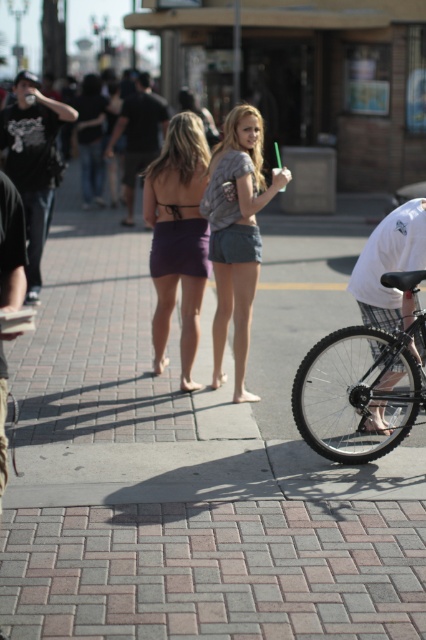
Can you confirm if black leather jacket at left is positioned to the left of black cotton t-shirt at upper center?

In fact, black leather jacket at left is to the right of black cotton t-shirt at upper center.

Is black leather jacket at left taller than black cotton t-shirt at upper center?

Incorrect, black leather jacket at left's height is not larger of black cotton t-shirt at upper center's.

The image size is (426, 640). Find the location of `black leather jacket at left`. black leather jacket at left is located at coordinates (11, 246).

Is purple matte skirt at center shorter than matte black t-shirt at left?

Yes.

Is purple matte skirt at center smaller than matte black t-shirt at left?

Yes.

Locate an element on the screen. The height and width of the screenshot is (640, 426). purple matte skirt at center is located at coordinates (178, 237).

Can you confirm if black matte bicycle at lower right is positioned above white mesh shorts at right?

No, black matte bicycle at lower right is not above white mesh shorts at right.

Does black matte bicycle at lower right have a greater height compared to white mesh shorts at right?

No.

Is point (299, 413) in front of point (408, 266)?

Yes, point (299, 413) is closer to viewer.

Locate an element on the screen. The width and height of the screenshot is (426, 640). black matte bicycle at lower right is located at coordinates (356, 392).